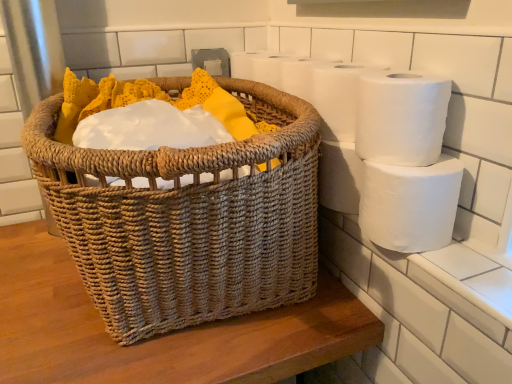
Question: Is woven natural basket at center far away from white matte toilet paper at right, which is the 3th toilet paper from top to bottom?

Choices:
 (A) yes
 (B) no

Answer: (B)

Question: Is woven natural basket at center bigger than white matte toilet paper at right, which is the 3th toilet paper from top to bottom?

Choices:
 (A) yes
 (B) no

Answer: (A)

Question: Considering the relative sizes of woven natural basket at center and white matte toilet paper at right, which is the 3th toilet paper from top to bottom, in the image provided, is woven natural basket at center thinner than white matte toilet paper at right, which is the 3th toilet paper from top to bottom,?

Choices:
 (A) no
 (B) yes

Answer: (A)

Question: From a real-world perspective, does woven natural basket at center stand above white matte toilet paper at right, which is counted as the 1th toilet paper, starting from the bottom?

Choices:
 (A) no
 (B) yes

Answer: (B)

Question: Is woven natural basket at center looking in the opposite direction of white matte toilet paper at right, which is counted as the 1th toilet paper, starting from the bottom?

Choices:
 (A) yes
 (B) no

Answer: (A)

Question: Is woven natural basket at center directly adjacent to white matte toilet paper at right, which is counted as the 1th toilet paper, starting from the bottom?

Choices:
 (A) no
 (B) yes

Answer: (A)

Question: Can you confirm if woven natural basket at center is thinner than white matte toilet paper at upper right, the third toilet paper ordered from the bottom?

Choices:
 (A) no
 (B) yes

Answer: (A)

Question: Is woven natural basket at center smaller than white matte toilet paper at upper right, the first toilet paper in the top-to-bottom sequence?

Choices:
 (A) yes
 (B) no

Answer: (B)

Question: Is woven natural basket at center beside white matte toilet paper at upper right, the third toilet paper ordered from the bottom?

Choices:
 (A) yes
 (B) no

Answer: (B)

Question: Does woven natural basket at center have a larger size compared to white matte toilet paper at upper right, the third toilet paper ordered from the bottom?

Choices:
 (A) yes
 (B) no

Answer: (A)

Question: From a real-world perspective, is woven natural basket at center physically below white matte toilet paper at upper right, the third toilet paper ordered from the bottom?

Choices:
 (A) no
 (B) yes

Answer: (B)

Question: Does woven natural basket at center have a lesser height compared to white matte toilet paper at upper right, the third toilet paper ordered from the bottom?

Choices:
 (A) yes
 (B) no

Answer: (B)

Question: Does white matte toilet paper at right, which is counted as the 1th toilet paper, starting from the bottom, have a smaller size compared to woven natural basket at center?

Choices:
 (A) no
 (B) yes

Answer: (B)